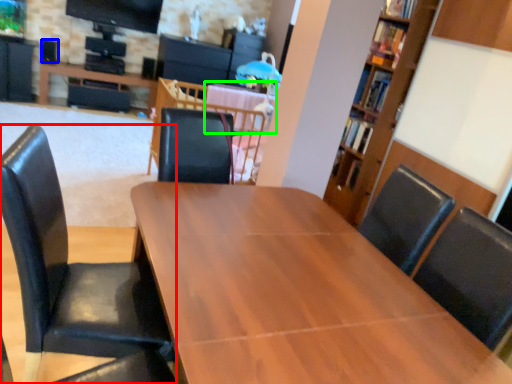
Question: Based on their relative distances, which object is farther from chair (highlighted by a red box)? Choose from speaker (highlighted by a blue box) and table (highlighted by a green box).

Choices:
 (A) speaker
 (B) table

Answer: (A)